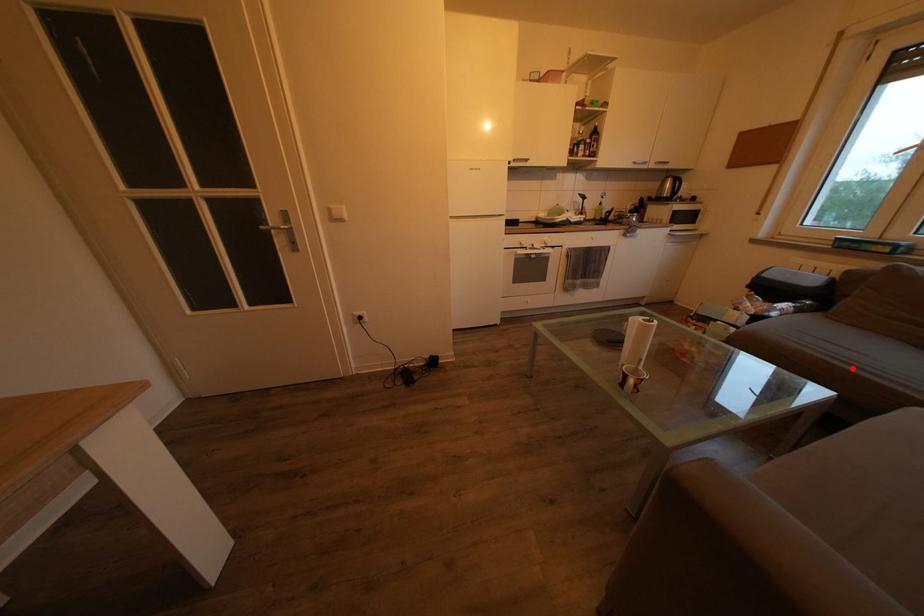
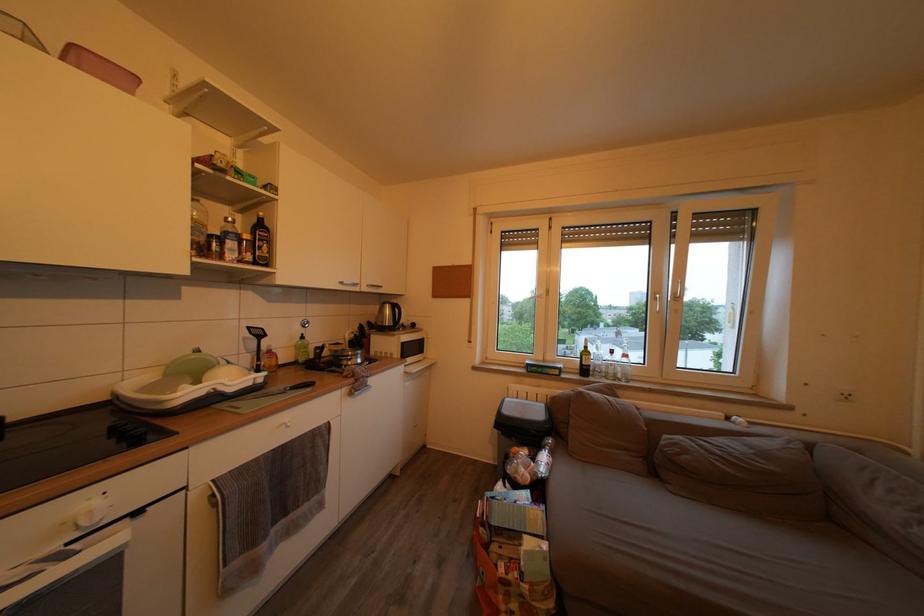
In the second image, find the point that corresponds to the highlighted location in the first image.

(685, 580)